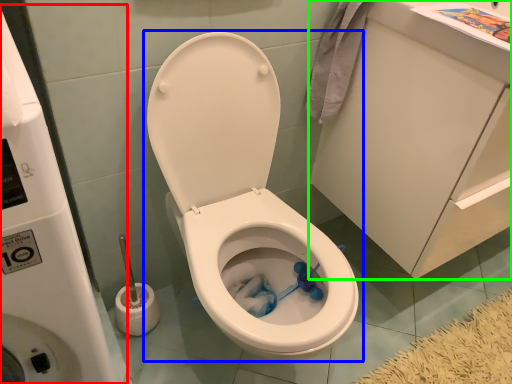
Question: Which object is the closest to the water tank (highlighted by a red box)? Choose among these: toilet (highlighted by a blue box) or porcelain (highlighted by a green box).

Choices:
 (A) toilet
 (B) porcelain

Answer: (A)